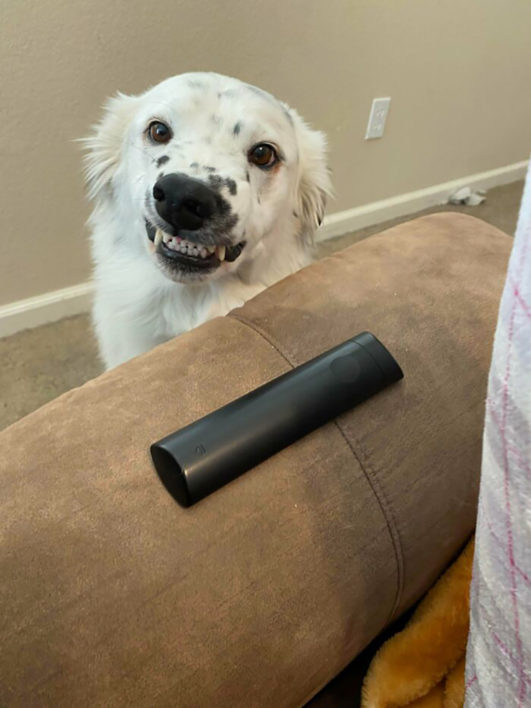
Image resolution: width=531 pixels, height=708 pixels. I want to click on sheet, so click(x=502, y=607).